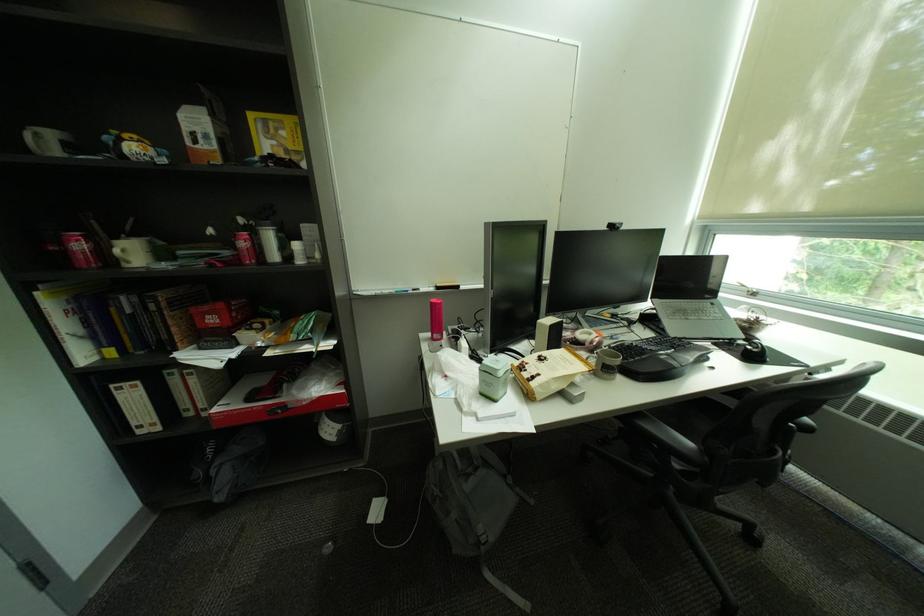
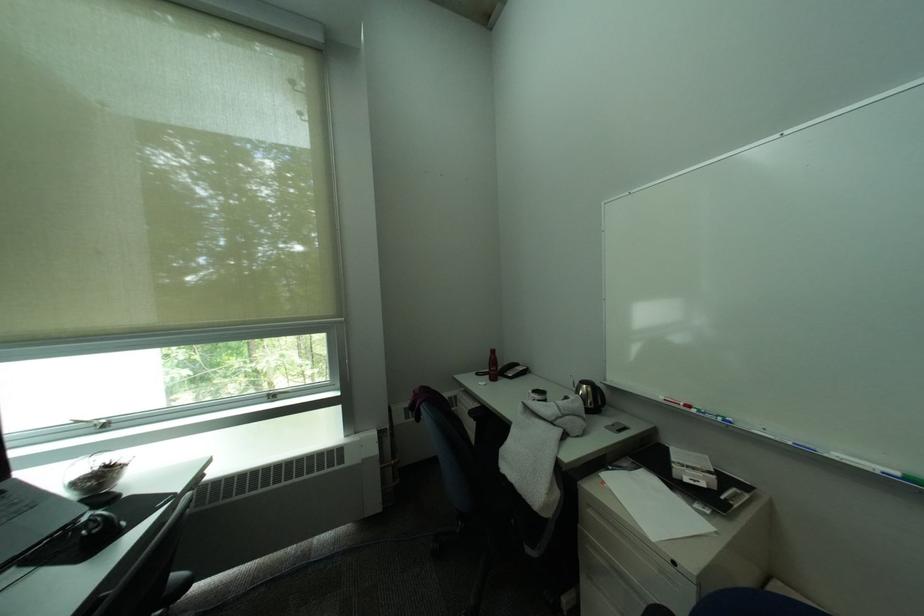
In the second image, find the point that corresponds to point (747, 321) in the first image.

(84, 485)